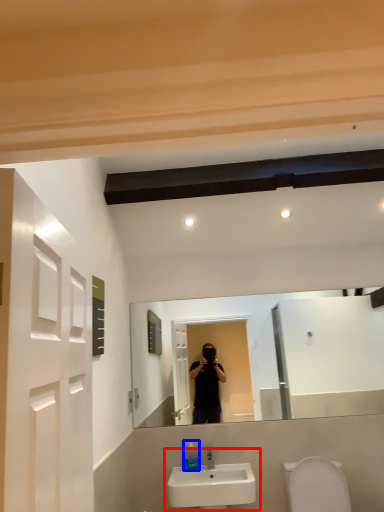
Question: Which point is closer to the camera, sink (highlighted by a red box) or soap dispenser (highlighted by a blue box)?

Choices:
 (A) sink
 (B) soap dispenser

Answer: (A)